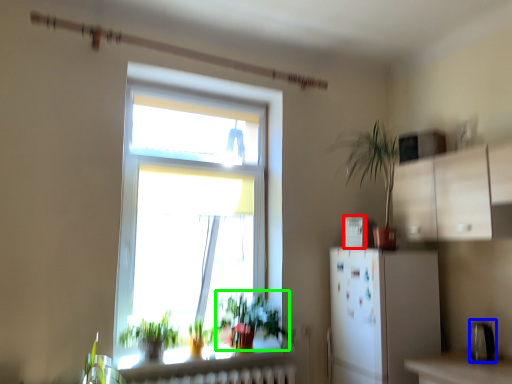
Question: Which object is positioned farthest from appliance (highlighted by a red box)? Select from appliance (highlighted by a blue box) and vegetation (highlighted by a green box).

Choices:
 (A) appliance
 (B) vegetation

Answer: (A)